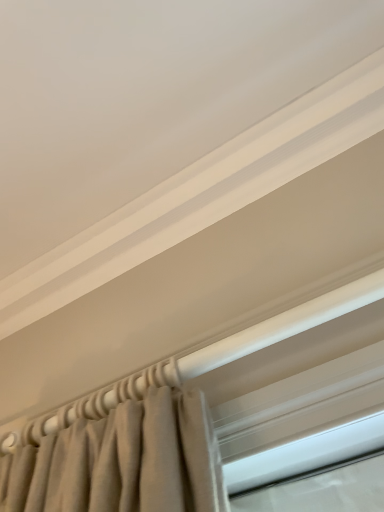
This screenshot has width=384, height=512. Identify the location of white glossy window at upper center. (149, 428).

Describe the element at coordinates (149, 428) in the screenshot. The width and height of the screenshot is (384, 512). I see `white glossy window at upper center` at that location.

Locate an element on the screen. The width and height of the screenshot is (384, 512). white glossy window at upper center is located at coordinates (149, 428).